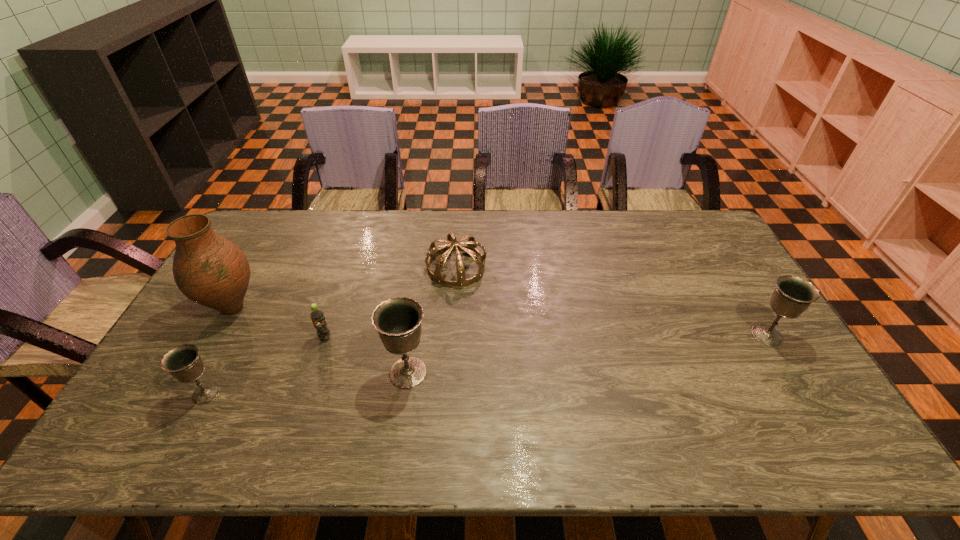
What are the coordinates of `vacant region located 0.150m on the back of the farthest chalice` in the screenshot? It's located at (737, 287).

Locate an element on the screen. This screenshot has height=540, width=960. free space located on the front label of the soda is located at coordinates (305, 399).

Locate an element on the screen. The image size is (960, 540). free region located on the left of the tiara is located at coordinates (402, 267).

Locate an element on the screen. The width and height of the screenshot is (960, 540). free space located 0.350m on the back of the tallest object is located at coordinates (280, 222).

Identify the location of object present at the far edge. coord(471,248).

The width and height of the screenshot is (960, 540). I want to click on chalice that is positioned at the left edge, so [183, 362].

The image size is (960, 540). I want to click on vase located in the left edge section of the desktop, so click(x=210, y=270).

I want to click on object that is at the right edge, so click(793, 295).

The width and height of the screenshot is (960, 540). Find the location of `object at the near left corner`. object at the near left corner is located at coordinates (183, 362).

I want to click on vacant space at the far edge of the desktop, so click(x=660, y=230).